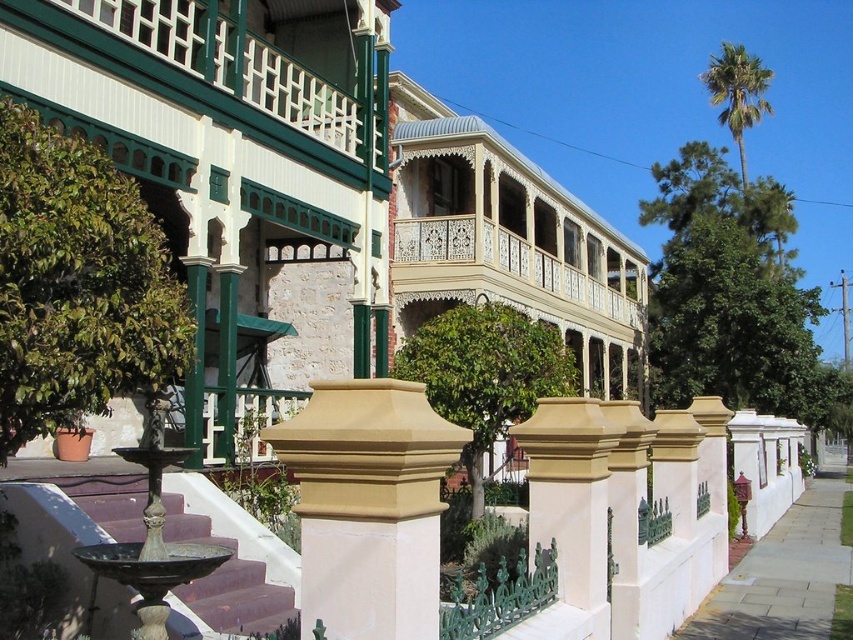
You are standing at the entrance of the historic building and want to locate the white painted wood balcony at upper center. According to the coordinates given, where should you look to find it?

The white painted wood balcony at upper center is located at coordinates point (503, 234).

Based on the photo, you are a delivery person trying to park your 1.2 meter wide cart near the building. The only available space is next to the slate gray paving stone at lower right. Can you park there without blocking the white painted wood balcony at upper center?

The white painted wood balcony at upper center might be wider than the slate gray paving stone at lower right, so there is a possibility that parking the cart next to the slate gray paving stone at lower right could block the balcony if the balcony extends beyond the paving stone. To be safe, check the actual width before parking.